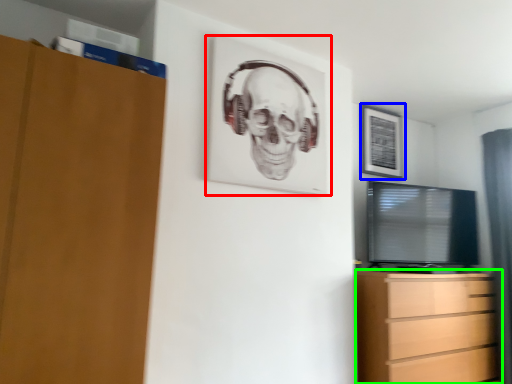
Question: Which is nearer to the picture frame (highlighted by a red box)? picture frame (highlighted by a blue box) or chest of drawers (highlighted by a green box).

Choices:
 (A) picture frame
 (B) chest of drawers

Answer: (B)